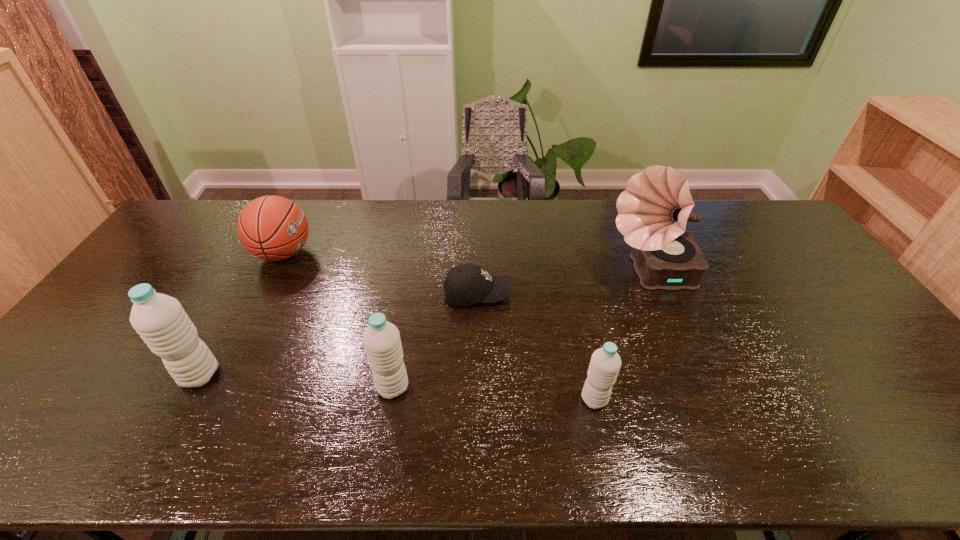
Please point a spot to add another water bottle on the right. Please provide its 2D coordinates. Your answer should be formatted as a tuple, i.e. [(x, y)], where the tuple contains the x and y coordinates of a point satisfying the conditions above.

[(806, 412)]